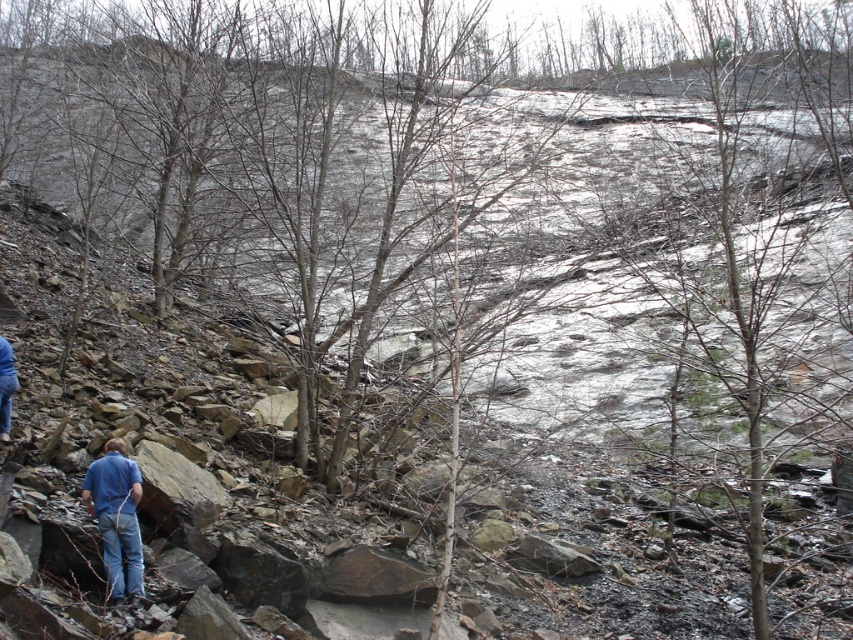
Is point (122, 548) farther from viewer compared to point (9, 385)?

No, (122, 548) is closer to viewer.

What do you see at coordinates (115, 518) in the screenshot? I see `blue jeans at lower left` at bounding box center [115, 518].

Between point (134, 504) and point (12, 388), which one is positioned behind?

The point (12, 388) is behind.

I want to click on blue jeans at lower left, so pyautogui.click(x=115, y=518).